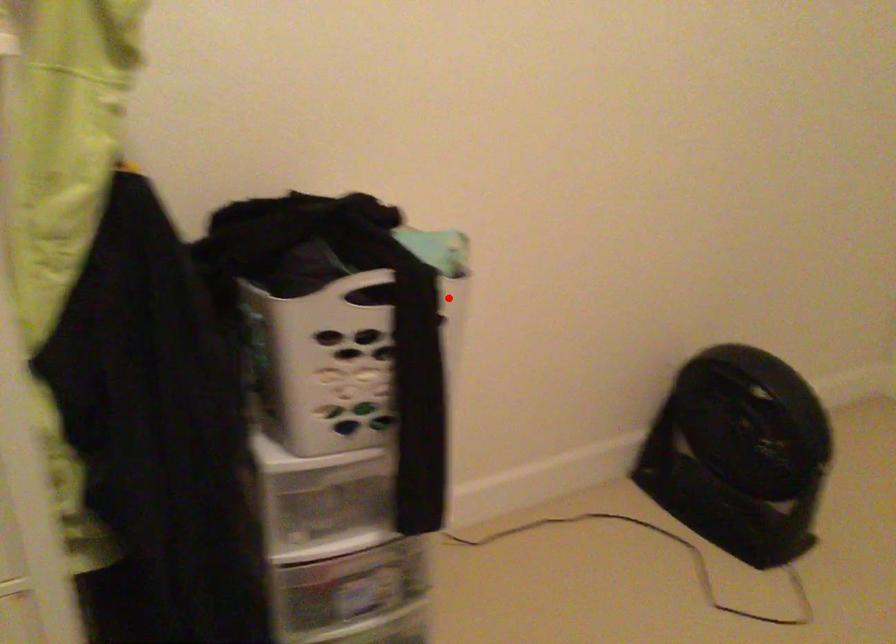
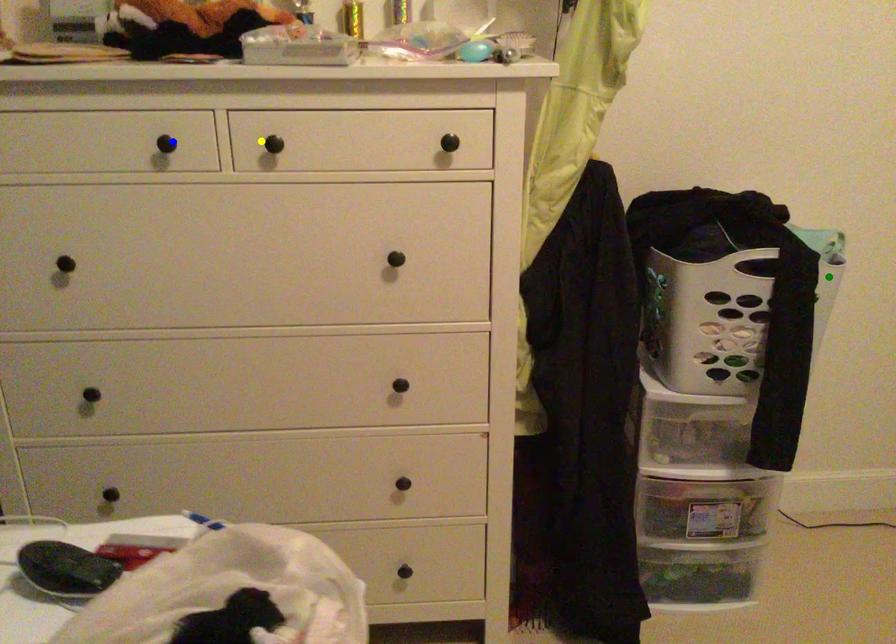
Question: I am providing you with two images of the same scene from different viewpoints. A red point is marked on the first image. You are given multiple points on the second image. Which spot in image 2 lines up with the point in image 1?

Choices:
 (A) green point
 (B) yellow point
 (C) blue point

Answer: (A)